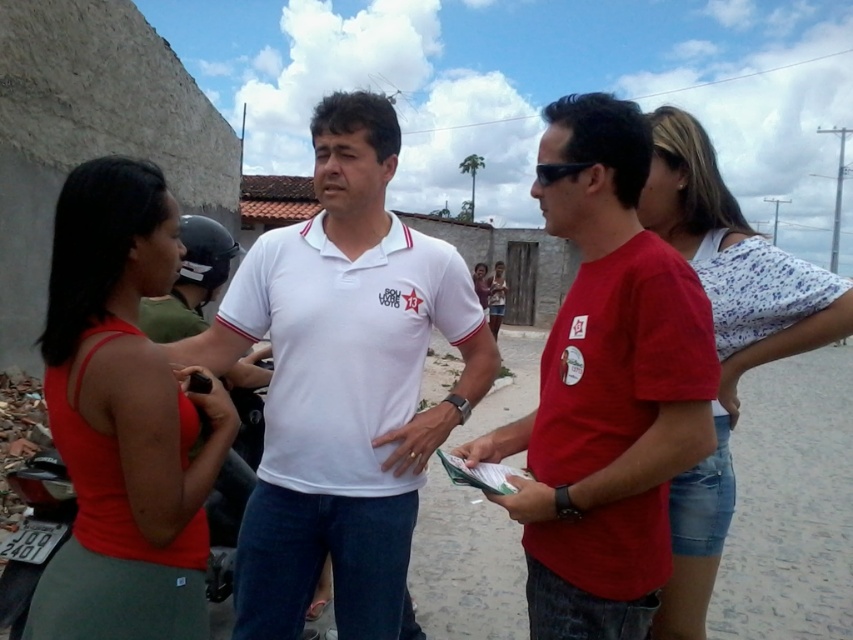
You are standing at the position of point (x=494, y=323) and want to move towards point (x=339, y=323). Based on the scene, will you be moving forward or backward?

Since point (x=339, y=323) is in front of point (x=494, y=323), moving towards it would mean moving forward.

You are a photographer trying to capture a group photo of the two people at the center wearing white shirts. You notice that one is labeled as white cotton shirt at center and the other as matte white shirt at center. Which one should you focus on if you want to photograph the person positioned to the right?

The matte white shirt at center should be the focus since the white cotton shirt at center is to its left, making the matte white shirt at center the one on the right.